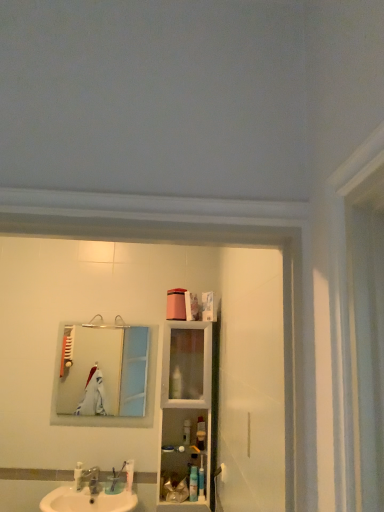
Question: Are white plastic toothbrush at lower center and white glossy sink at lower left making contact?

Choices:
 (A) no
 (B) yes

Answer: (A)

Question: From a real-world perspective, is white plastic toothbrush at lower center on white glossy sink at lower left?

Choices:
 (A) no
 (B) yes

Answer: (B)

Question: Considering the relative positions of white plastic toothbrush at lower center and white glossy sink at lower left in the image provided, is white plastic toothbrush at lower center to the right of white glossy sink at lower left from the viewer's perspective?

Choices:
 (A) no
 (B) yes

Answer: (B)

Question: Is white glossy sink at lower left inside white plastic toothbrush at lower center?

Choices:
 (A) no
 (B) yes

Answer: (A)

Question: From the image's perspective, is white plastic toothbrush at lower center beneath white glossy sink at lower left?

Choices:
 (A) yes
 (B) no

Answer: (B)

Question: Is white plastic toothbrush at lower center further to the viewer compared to white glossy sink at lower left?

Choices:
 (A) yes
 (B) no

Answer: (A)

Question: From the image's perspective, would you say white plastic toothbrush at lower center is shown under brushed metal faucet at sink front?

Choices:
 (A) yes
 (B) no

Answer: (A)

Question: Is white plastic toothbrush at lower center facing away from brushed metal faucet at sink front?

Choices:
 (A) yes
 (B) no

Answer: (B)

Question: Can you confirm if white plastic toothbrush at lower center is taller than brushed metal faucet at sink front?

Choices:
 (A) no
 (B) yes

Answer: (B)

Question: Does white plastic toothbrush at lower center appear on the right side of brushed metal faucet at sink front?

Choices:
 (A) yes
 (B) no

Answer: (A)

Question: Is white plastic toothbrush at lower center placed right next to brushed metal faucet at sink front?

Choices:
 (A) no
 (B) yes

Answer: (A)

Question: From a real-world perspective, is white plastic toothbrush at lower center located beneath brushed metal faucet at sink front?

Choices:
 (A) no
 (B) yes

Answer: (A)

Question: Considering the relative sizes of translucent plastic container at center, which is the 2th toiletry in left-to-right order, and brushed metal faucet at sink front in the image provided, is translucent plastic container at center, which is the 2th toiletry in left-to-right order, shorter than brushed metal faucet at sink front?

Choices:
 (A) no
 (B) yes

Answer: (A)